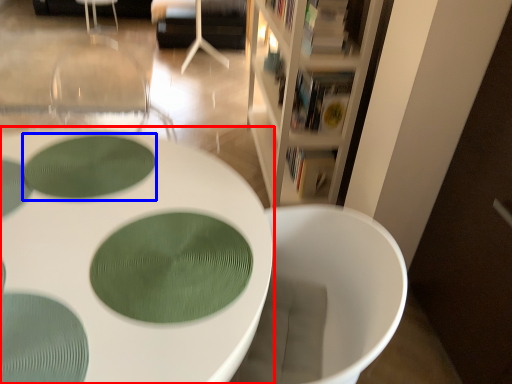
Question: Which of the following is the closest to the observer, table (highlighted by a red box) or oval (highlighted by a blue box)?

Choices:
 (A) table
 (B) oval

Answer: (A)